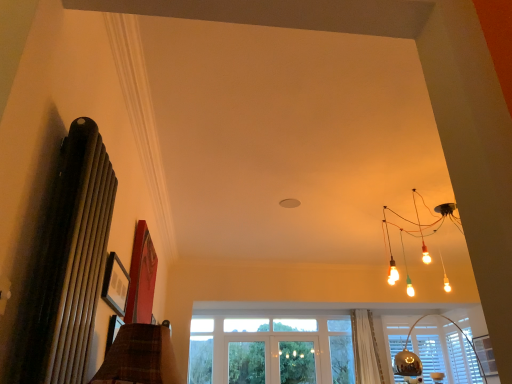
Question: From the image's perspective, is matte black picture frame at upper left over translucent glass screen door at center?

Choices:
 (A) yes
 (B) no

Answer: (A)

Question: Is matte black picture frame at upper left turned away from translucent glass screen door at center?

Choices:
 (A) yes
 (B) no

Answer: (B)

Question: Does matte black picture frame at upper left have a greater height compared to translucent glass screen door at center?

Choices:
 (A) yes
 (B) no

Answer: (B)

Question: Is matte black picture frame at upper left at the right side of translucent glass screen door at center?

Choices:
 (A) yes
 (B) no

Answer: (B)

Question: Is matte black picture frame at upper left shorter than translucent glass screen door at center?

Choices:
 (A) yes
 (B) no

Answer: (A)

Question: Based on their sizes in the image, would you say matte black picture frame at upper left is bigger or smaller than metallic silver lampshade at lower right?

Choices:
 (A) big
 (B) small

Answer: (B)

Question: From the image's perspective, is matte black picture frame at upper left above or below metallic silver lampshade at lower right?

Choices:
 (A) above
 (B) below

Answer: (A)

Question: From a real-world perspective, is matte black picture frame at upper left positioned above or below metallic silver lampshade at lower right?

Choices:
 (A) above
 (B) below

Answer: (A)

Question: In the image, is matte black picture frame at upper left positioned in front of or behind metallic silver lampshade at lower right?

Choices:
 (A) front
 (B) behind

Answer: (A)

Question: Is point (357, 365) positioned closer to the camera than point (290, 372)?

Choices:
 (A) farther
 (B) closer

Answer: (B)

Question: Considering the relative positions of white sheer curtain at lower center and translucent glass screen door at center in the image provided, is white sheer curtain at lower center to the left or to the right of translucent glass screen door at center?

Choices:
 (A) right
 (B) left

Answer: (A)

Question: From the image's perspective, is white sheer curtain at lower center positioned above or below translucent glass screen door at center?

Choices:
 (A) below
 (B) above

Answer: (B)

Question: In terms of width, does white sheer curtain at lower center look wider or thinner when compared to translucent glass screen door at center?

Choices:
 (A) thin
 (B) wide

Answer: (B)

Question: From the image's perspective, relative to matte black picture frame at upper left, is metallic silver lampshade at lower right above or below?

Choices:
 (A) above
 (B) below

Answer: (B)

Question: Is point (409, 327) closer or farther from the camera than point (110, 304)?

Choices:
 (A) closer
 (B) farther

Answer: (B)